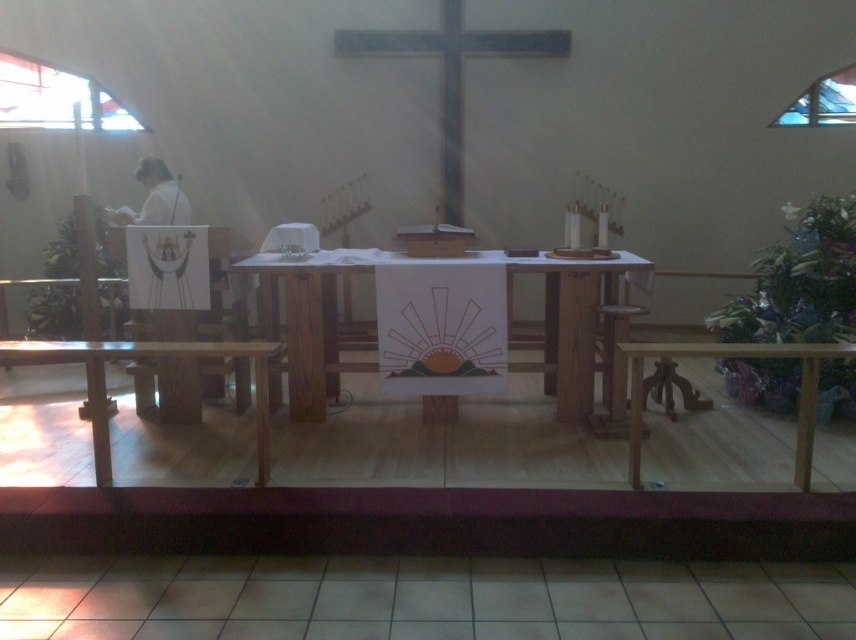
Question: Which point is closer to the camera?

Choices:
 (A) wooden table at center
 (B) wooden table at lower left
 (C) wooden stool at center

Answer: (B)

Question: Which object is the closest to the wooden table at lower left?

Choices:
 (A) wooden table at lower right
 (B) wooden stool at center
 (C) wooden cross at center

Answer: (A)

Question: Does wooden table at center appear on the left side of wooden cross at center?

Choices:
 (A) no
 (B) yes

Answer: (A)

Question: Among these points, which one is nearest to the camera?

Choices:
 (A) (717, 355)
 (B) (311, 305)
 (C) (108, 429)
 (D) (616, 365)

Answer: (A)

Question: Does wooden cross at center appear over wooden table at lower right?

Choices:
 (A) no
 (B) yes

Answer: (B)

Question: Is wooden table at lower left in front of wooden stool at center?

Choices:
 (A) no
 (B) yes

Answer: (B)